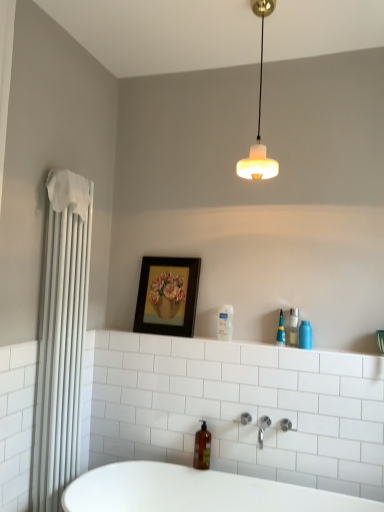
Question: From a real-world perspective, does translucent plastic pen at upper right, the 3th toiletry positioned from the right, stand above white fabric towel at left?

Choices:
 (A) no
 (B) yes

Answer: (B)

Question: Is white fabric towel at left at the back of translucent plastic pen at upper right, placed as the second toiletry when sorted from left to right?

Choices:
 (A) yes
 (B) no

Answer: (B)

Question: Considering the relative sizes of translucent plastic pen at upper right, the 3th toiletry positioned from the right, and white fabric towel at left in the image provided, is translucent plastic pen at upper right, the 3th toiletry positioned from the right, smaller than white fabric towel at left?

Choices:
 (A) yes
 (B) no

Answer: (A)

Question: From a real-world perspective, is translucent plastic pen at upper right, the 3th toiletry positioned from the right, below white fabric towel at left?

Choices:
 (A) no
 (B) yes

Answer: (A)

Question: Can you confirm if translucent plastic pen at upper right, the 3th toiletry positioned from the right, is wider than white fabric towel at left?

Choices:
 (A) no
 (B) yes

Answer: (A)

Question: Is translucent plastic pen at upper right, placed as the second toiletry when sorted from left to right, not within white fabric towel at left?

Choices:
 (A) yes
 (B) no

Answer: (A)

Question: Is white glossy bathtub at lower center at the right side of white fabric towel at left?

Choices:
 (A) yes
 (B) no

Answer: (A)

Question: Is white glossy bathtub at lower center at the left side of white fabric towel at left?

Choices:
 (A) yes
 (B) no

Answer: (B)

Question: Does white glossy bathtub at lower center have a larger size compared to white fabric towel at left?

Choices:
 (A) no
 (B) yes

Answer: (B)

Question: From a real-world perspective, is white glossy bathtub at lower center under white fabric towel at left?

Choices:
 (A) yes
 (B) no

Answer: (A)

Question: Considering the relative sizes of white glossy bathtub at lower center and white fabric towel at left in the image provided, is white glossy bathtub at lower center thinner than white fabric towel at left?

Choices:
 (A) yes
 (B) no

Answer: (B)

Question: Is white fabric towel at left located within white glossy bathtub at lower center?

Choices:
 (A) yes
 (B) no

Answer: (B)

Question: Is wooden framed painting at center wider than clear glass bottle at upper right, which is the third toiletry from left to right?

Choices:
 (A) yes
 (B) no

Answer: (B)